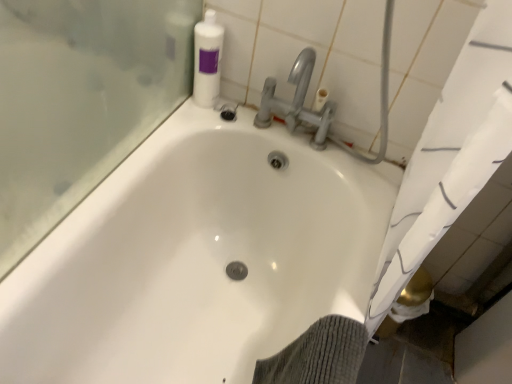
Question: Does point [220, 41] appear closer or farther from the camera than point [348, 246]?

Choices:
 (A) closer
 (B) farther

Answer: (B)

Question: From their relative heights in the image, would you say white plastic bottle at upper right is taller or shorter than white glossy bathtub at center?

Choices:
 (A) tall
 (B) short

Answer: (B)

Question: From the image's perspective, relative to white glossy bathtub at center, is white plastic bottle at upper right above or below?

Choices:
 (A) below
 (B) above

Answer: (B)

Question: Do you think white glossy bathtub at center is within white plastic bottle at upper right, or outside of it?

Choices:
 (A) inside
 (B) outside

Answer: (B)

Question: In terms of height, does white glossy bathtub at center look taller or shorter compared to white plastic bottle at upper right?

Choices:
 (A) short
 (B) tall

Answer: (B)

Question: From a real-world perspective, is white glossy bathtub at center above or below white plastic bottle at upper right?

Choices:
 (A) above
 (B) below

Answer: (B)

Question: From the image's perspective, is white glossy bathtub at center above or below white plastic bottle at upper right?

Choices:
 (A) above
 (B) below

Answer: (B)